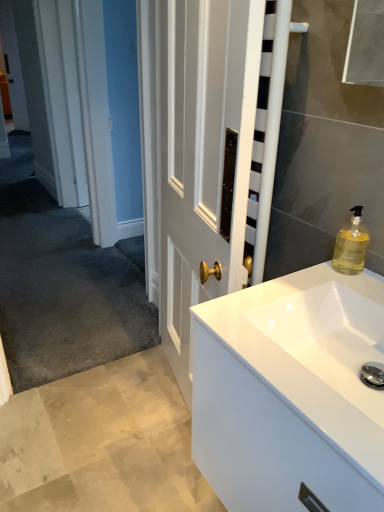
Question: From the image's perspective, is translucent yellow liquid at upper right located beneath white glossy cabinet at lower right?

Choices:
 (A) no
 (B) yes

Answer: (A)

Question: Considering the relative sizes of translucent yellow liquid at upper right and white glossy cabinet at lower right in the image provided, is translucent yellow liquid at upper right taller than white glossy cabinet at lower right?

Choices:
 (A) yes
 (B) no

Answer: (A)

Question: Is translucent yellow liquid at upper right at the left side of white glossy cabinet at lower right?

Choices:
 (A) no
 (B) yes

Answer: (A)

Question: Can you confirm if translucent yellow liquid at upper right is thinner than white glossy cabinet at lower right?

Choices:
 (A) no
 (B) yes

Answer: (B)

Question: Can you see translucent yellow liquid at upper right touching white glossy cabinet at lower right?

Choices:
 (A) no
 (B) yes

Answer: (A)

Question: Is translucent yellow liquid at upper right looking in the opposite direction of white glossy cabinet at lower right?

Choices:
 (A) yes
 (B) no

Answer: (B)

Question: Is there a large distance between white glossy cabinet at lower right and translucent yellow liquid at upper right?

Choices:
 (A) no
 (B) yes

Answer: (A)

Question: Could you tell me if white glossy cabinet at lower right is facing translucent yellow liquid at upper right?

Choices:
 (A) yes
 (B) no

Answer: (B)

Question: From the image's perspective, is white glossy cabinet at lower right located above translucent yellow liquid at upper right?

Choices:
 (A) yes
 (B) no

Answer: (B)

Question: Is white glossy cabinet at lower right looking in the opposite direction of translucent yellow liquid at upper right?

Choices:
 (A) yes
 (B) no

Answer: (B)

Question: Is white glossy cabinet at lower right at the left side of translucent yellow liquid at upper right?

Choices:
 (A) no
 (B) yes

Answer: (B)

Question: Is white glossy cabinet at lower right thinner than translucent yellow liquid at upper right?

Choices:
 (A) yes
 (B) no

Answer: (B)

Question: From a real-world perspective, is translucent yellow liquid at upper right physically located above or below white glossy cabinet at lower right?

Choices:
 (A) above
 (B) below

Answer: (A)